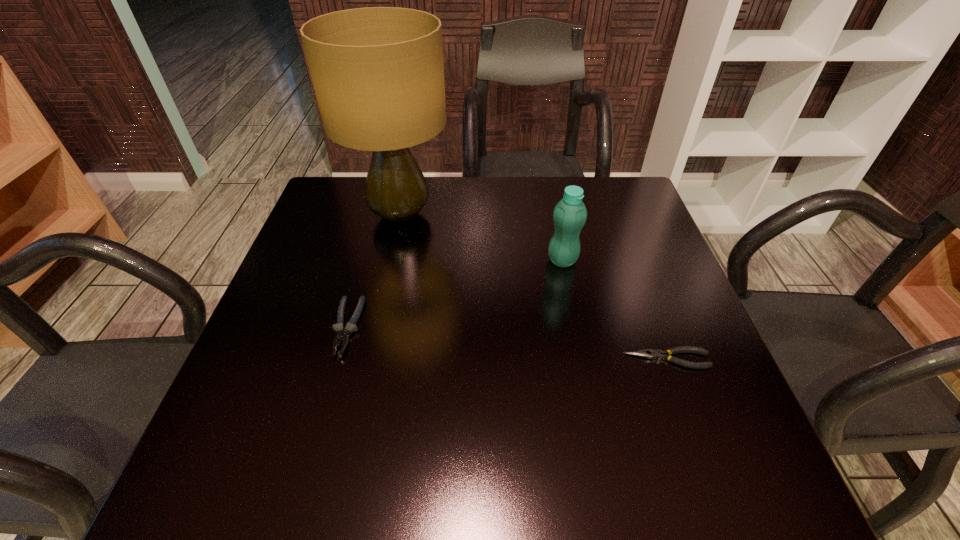
Where is `vacant space at the right edge of the desktop`? vacant space at the right edge of the desktop is located at coordinates (608, 235).

This screenshot has height=540, width=960. In order to click on vacant region at the far left corner of the desktop in this screenshot , I will do `click(325, 213)`.

At what (x,y) coordinates should I click in order to perform the action: click on vacant area at the far right corner of the desktop. Please return your answer as a coordinate pair (x, y). The width and height of the screenshot is (960, 540). Looking at the image, I should click on (634, 188).

Identify the location of free space between the rightmost object and the third shortest object. (614, 310).

Locate an element on the screen. unoccupied area between the farthest object and the third shortest object is located at coordinates (481, 238).

At what (x,y) coordinates should I click in order to perform the action: click on vacant region between the third nearest object and the right pliers. Please return your answer as a coordinate pair (x, y). Looking at the image, I should click on (614, 310).

Where is `vacant space in between the taller pliers and the right pliers`? This screenshot has height=540, width=960. vacant space in between the taller pliers and the right pliers is located at coordinates pyautogui.click(x=507, y=343).

The image size is (960, 540). I want to click on vacant space that's between the second shortest object and the farthest object, so click(x=373, y=271).

Image resolution: width=960 pixels, height=540 pixels. What are the coordinates of `empty space that is in between the left pliers and the second farthest object` in the screenshot? It's located at (455, 294).

Image resolution: width=960 pixels, height=540 pixels. Identify the location of unoccupied area between the second tallest object and the right pliers. (614, 310).